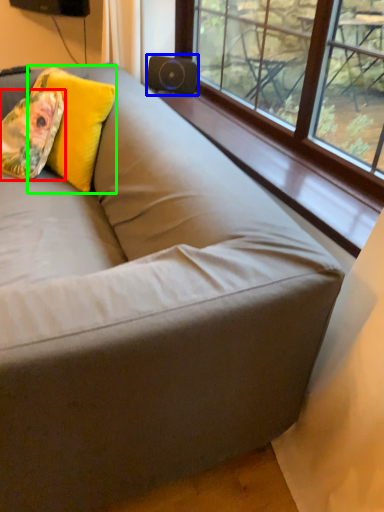
Question: Which object is positioned farthest from throw pillow (highlighted by a red box)? Select from speaker (highlighted by a blue box) and throw pillow (highlighted by a green box).

Choices:
 (A) speaker
 (B) throw pillow

Answer: (A)